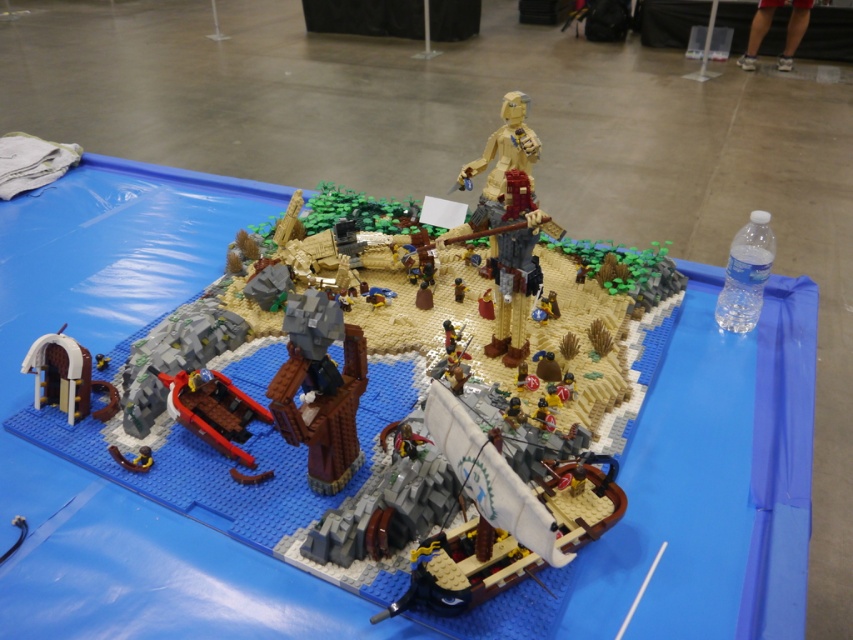
Question: Which object is closer to the camera taking this photo?

Choices:
 (A) brown wooden archway at lower left
 (B) metallic blue sword at lower left

Answer: (B)

Question: Is brown wooden archway at lower left below metallic blue sword at lower left?

Choices:
 (A) no
 (B) yes

Answer: (A)

Question: Which of the following is the closest to the observer?

Choices:
 (A) brown wooden archway at lower left
 (B) metallic blue sword at lower left

Answer: (B)

Question: Is dark brown wood tree trunk at center positioned before brown wooden archway at lower left?

Choices:
 (A) yes
 (B) no

Answer: (A)

Question: Which object is the farthest from the dark brown wood tree trunk at center?

Choices:
 (A) brown wooden archway at lower left
 (B) metallic blue sword at lower left

Answer: (A)

Question: Can you confirm if dark brown wood tree trunk at center is thinner than brown wooden archway at lower left?

Choices:
 (A) yes
 (B) no

Answer: (A)